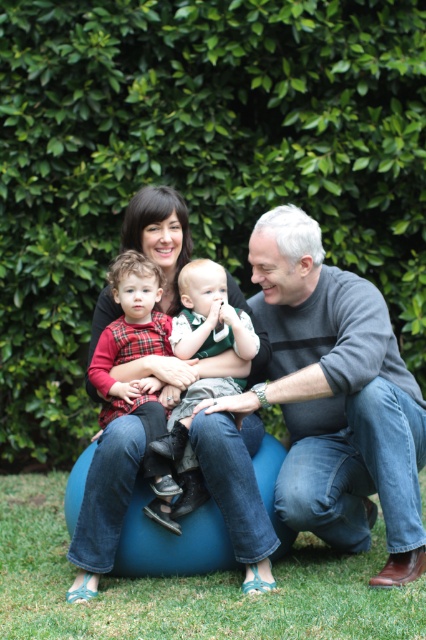
You are standing in the garden where the family is sitting. If you want to take a photo of the family without including the green leafy hedge at upper center, which direction should you move your camera? Please answer with a direction like north, south, east, west, or a combination like northeast.

Move the camera south or southwest to avoid including the green leafy hedge at upper center in the photo.

You are a photographer setting up for a family portrait. You want to ensure the gray sweater at center and the green grass at lower center are both in focus. Given that your camera has a depth of field that can cover objects within 30 inches of each other, will both be in focus?

The gray sweater at center and green grass at lower center are 32.79 inches apart. Since the distance between them exceeds the camera depth of field coverage of 30 inches, they cannot both be in focus simultaneously.

In the scene shown: You are a photographer setting up for a family portrait. The family is seated near a green leafy hedge at upper center and a flannel shirt at center. To ensure both the hedge and the shirt are in the frame, where should you position the camera relative to the family?

The green leafy hedge at upper center is to the right of the flannel shirt at center, so position the camera to the left of the family to include both the hedge and the shirt in the frame.